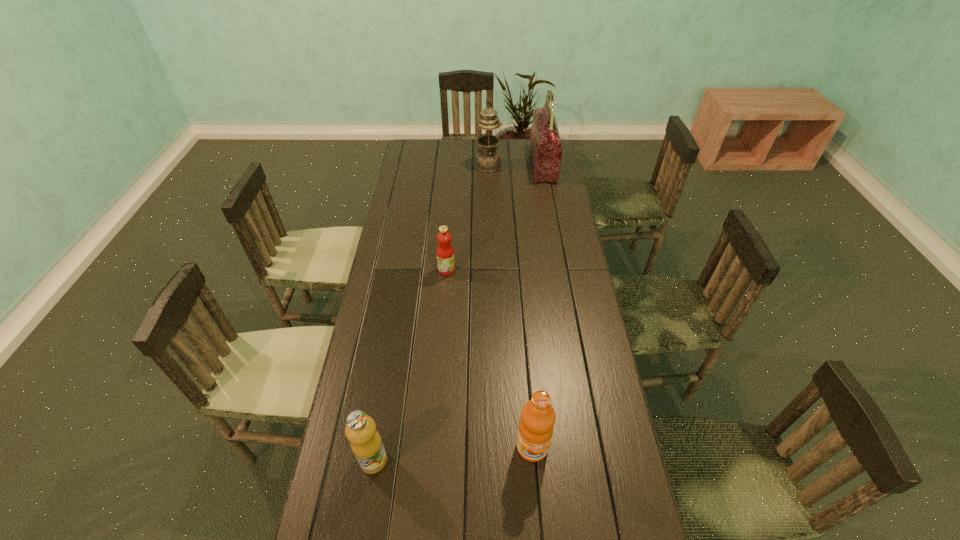
You are a GUI agent. You are given a task and a screenshot of the screen. Output one action in this format:
    pyautogui.click(x=<x>, y=<y>)
    Task: Click on the empty location between the leftmost fruit juice and the rightmost fruit juice
    This screenshot has height=540, width=960.
    Given the screenshot: What is the action you would take?
    pyautogui.click(x=453, y=454)

I want to click on free space between the farthest fruit juice and the tallest object, so click(494, 218).

Find the location of a particular element. The width and height of the screenshot is (960, 540). the third closest object to the oil lamp is located at coordinates (536, 424).

Find the location of a particular element. The height and width of the screenshot is (540, 960). the second closest object to the leftmost object is located at coordinates (445, 253).

At what (x,y) coordinates should I click in order to perform the action: click on fruit juice that stands as the closest to the handbag. Please return your answer as a coordinate pair (x, y). Looking at the image, I should click on (445, 253).

Locate an element on the screen. This screenshot has height=540, width=960. fruit juice that is the nearest to the leftmost fruit juice is located at coordinates (536, 424).

You are a GUI agent. You are given a task and a screenshot of the screen. Output one action in this format:
    pyautogui.click(x=<x>, y=<y>)
    Task: Click on the free space that satisfies the following two spatial constraints: 1. on the front side of the oil lamp; 2. on the front label of the third nearest object
    The image size is (960, 540).
    Given the screenshot: What is the action you would take?
    pyautogui.click(x=491, y=270)

The height and width of the screenshot is (540, 960). Identify the location of vacant space that satisfies the following two spatial constraints: 1. on the front-facing side of the tallest object; 2. on the label side of the rightmost fruit juice. (594, 447).

Image resolution: width=960 pixels, height=540 pixels. What are the coordinates of `free space that satisfies the following two spatial constraints: 1. on the front-facing side of the tallest object; 2. on the label side of the rightmost fruit juice` in the screenshot? It's located at (594, 447).